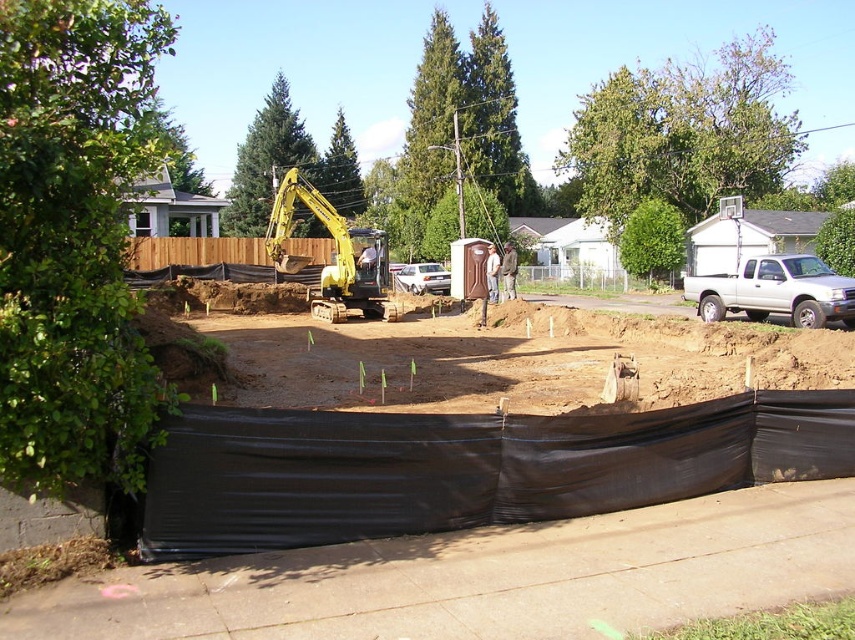
Does black plastic tarp at center appear on the left side of yellow rubber excavator at center?

In fact, black plastic tarp at center is to the right of yellow rubber excavator at center.

Does point (374, 413) come closer to viewer compared to point (370, 310)?

Yes, it is in front of point (370, 310).

Identify the location of black plastic tarp at center. (478, 577).